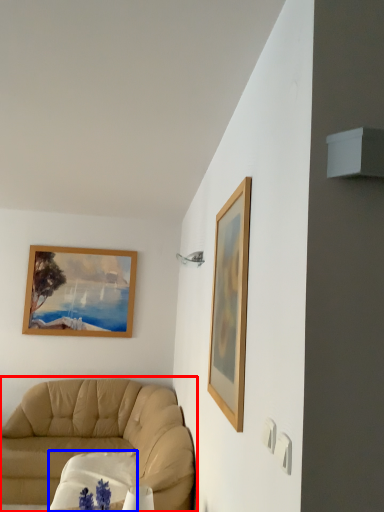
Question: Which of the following is the farthest to the observer, studio couch (highlighted by a red box) or round table (highlighted by a blue box)?

Choices:
 (A) studio couch
 (B) round table

Answer: (B)